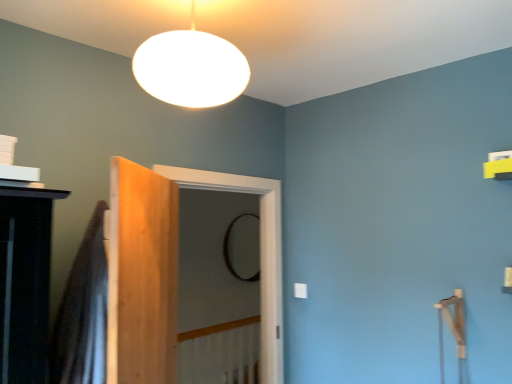
Question: Should I look upward or downward to see clear glass screen door at center?

Choices:
 (A) up
 (B) down

Answer: (B)

Question: From a real-world perspective, is white matte/soft lampshade at upper center positioned under translucent fabric shower curtain at left based on gravity?

Choices:
 (A) no
 (B) yes

Answer: (A)

Question: Does white matte/soft lampshade at upper center have a lesser height compared to translucent fabric shower curtain at left?

Choices:
 (A) no
 (B) yes

Answer: (B)

Question: Is white matte/soft lampshade at upper center smaller than translucent fabric shower curtain at left?

Choices:
 (A) no
 (B) yes

Answer: (A)

Question: Is white matte/soft lampshade at upper center to the left of translucent fabric shower curtain at left from the viewer's perspective?

Choices:
 (A) yes
 (B) no

Answer: (B)

Question: Is white matte/soft lampshade at upper center oriented away from translucent fabric shower curtain at left?

Choices:
 (A) yes
 (B) no

Answer: (B)

Question: Is white matte/soft lampshade at upper center not near translucent fabric shower curtain at left?

Choices:
 (A) no
 (B) yes

Answer: (A)

Question: Considering the relative sizes of light brown wood door at center and black glass mirror at center in the image provided, is light brown wood door at center smaller than black glass mirror at center?

Choices:
 (A) no
 (B) yes

Answer: (A)

Question: Would you say black glass mirror at center is part of light brown wood door at center's contents?

Choices:
 (A) yes
 (B) no

Answer: (B)

Question: Could you tell me if light brown wood door at center is facing black glass mirror at center?

Choices:
 (A) yes
 (B) no

Answer: (B)

Question: Is light brown wood door at center outside black glass mirror at center?

Choices:
 (A) yes
 (B) no

Answer: (A)

Question: From a real-world perspective, is light brown wood door at center physically below black glass mirror at center?

Choices:
 (A) no
 (B) yes

Answer: (B)

Question: From the image's perspective, would you say light brown wood door at center is shown under black glass mirror at center?

Choices:
 (A) no
 (B) yes

Answer: (A)

Question: From the image's perspective, is light brown wood door at center below white matte/soft lampshade at upper center?

Choices:
 (A) no
 (B) yes

Answer: (B)